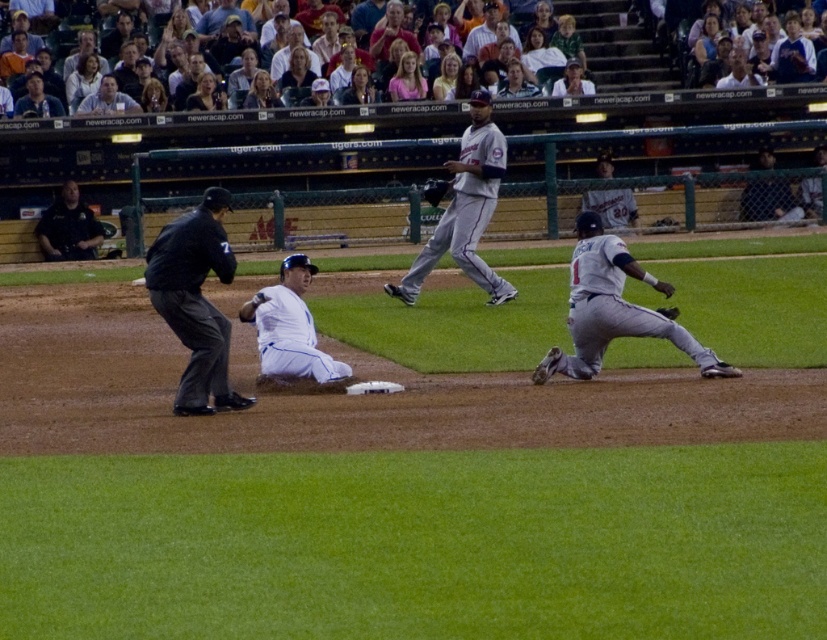
Can you confirm if gray matte uniform at lower right is positioned below dark gray leather glove at lower right?

Yes, gray matte uniform at lower right is below dark gray leather glove at lower right.

The image size is (827, 640). Find the location of `gray matte uniform at lower right`. gray matte uniform at lower right is located at coordinates (613, 308).

Does point (290, 280) come behind point (667, 316)?

Yes, point (290, 280) is behind point (667, 316).

Which is above, white uniform at center or dark gray leather glove at lower right?

dark gray leather glove at lower right

At what (x,y) coordinates should I click in order to perform the action: click on white uniform at center. Please return your answer as a coordinate pair (x, y). Looking at the image, I should click on (289, 326).

Based on the photo, does gray uniformed player at center appear on the right side of dark blue uniform at upper center?

Yes, gray uniformed player at center is to the right of dark blue uniform at upper center.

Between gray uniformed player at center and dark blue uniform at upper center, which one is positioned lower?

gray uniformed player at center

Is point (462, 216) behind point (122, 99)?

No, it is not.

I want to click on gray uniformed player at center, so click(466, 209).